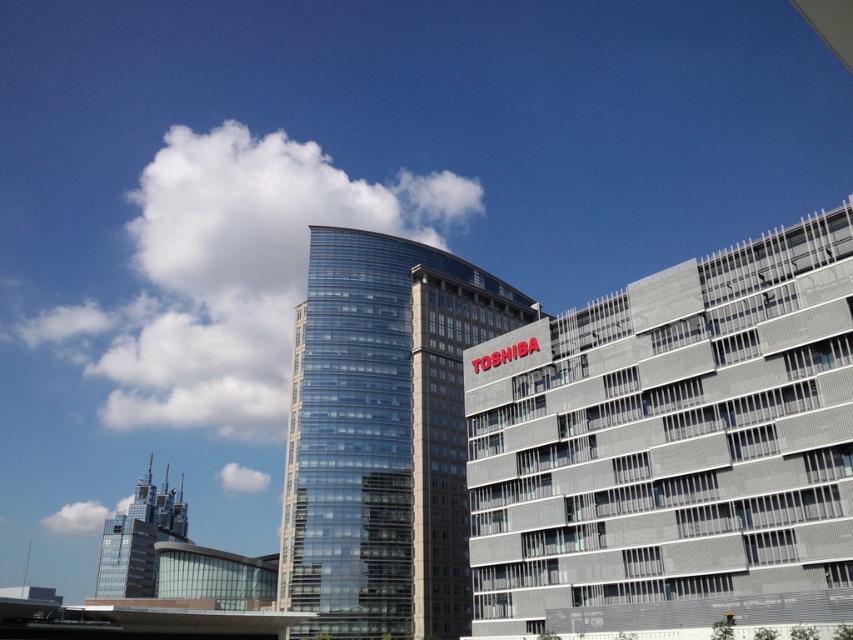
You are an architect analyzing the urban layout. Given the gray metallic building at upper right and the transparent glass building at center, which one would require less material for a scale model if both are to be built at the same scale?

The gray metallic building at upper right requires less material because it has a smaller size compared to the transparent glass building at center.

Please use the coordinates provided to determine the position of the gray metallic building at upper right in the image. What are its coordinates?

The gray metallic building at upper right is located at coordinates (x=669, y=436).